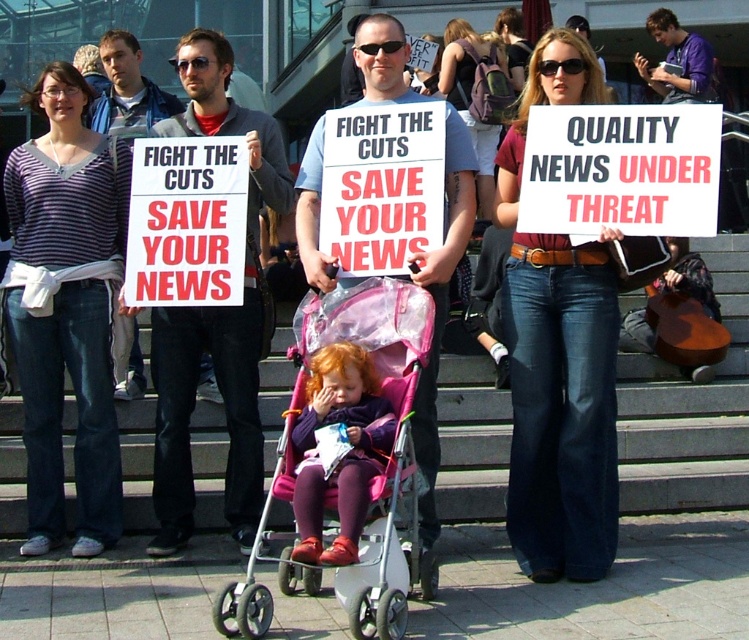
Question: Is pink plastic baby carriage at center to the right of purple fleece jacket at center from the viewer's perspective?

Choices:
 (A) yes
 (B) no

Answer: (A)

Question: Among these points, which one is farthest from the camera?

Choices:
 (A) (327, 413)
 (B) (415, 436)
 (C) (306, 492)
 (D) (115, 72)

Answer: (D)

Question: Observing the image, what is the correct spatial positioning of striped cotton shirt at center in reference to denim shorts at center?

Choices:
 (A) below
 (B) above

Answer: (A)

Question: Which object is farther from the camera taking this photo?

Choices:
 (A) matte gray shirt at center
 (B) denim jeans at center
 (C) purple fleece jacket at center

Answer: (A)

Question: Is pink plastic baby carriage at center to the right of matte blue t-shirt at center from the viewer's perspective?

Choices:
 (A) yes
 (B) no

Answer: (B)

Question: Which of the following is the closest to the observer?

Choices:
 (A) (518, 298)
 (B) (427, 556)

Answer: (B)